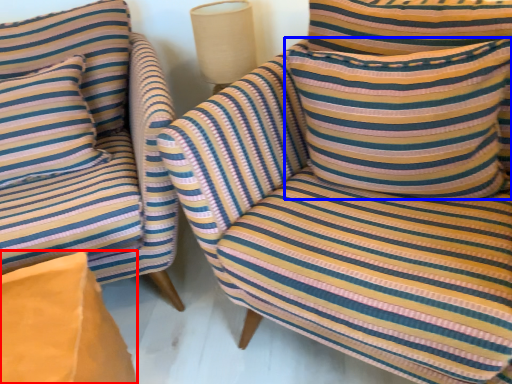
Question: Which object appears farthest to the camera in this image, cardboard box (highlighted by a red box) or pillow (highlighted by a blue box)?

Choices:
 (A) cardboard box
 (B) pillow

Answer: (B)